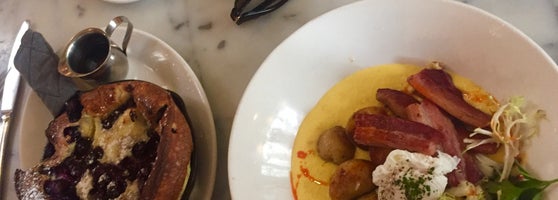
Locate an element on the screen. nasty looking cream table is located at coordinates (66, 23).